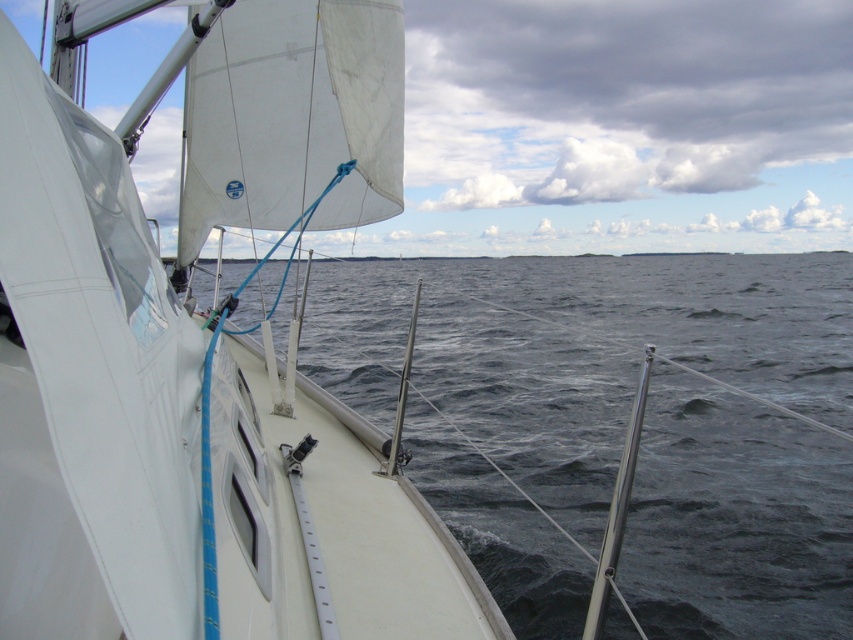
Question: Which point appears closest to the camera in this image?

Choices:
 (A) (224, 547)
 (B) (505, 385)

Answer: (A)

Question: From the image, what is the correct spatial relationship of white matte sailboat at left in relation to dark blue water at center?

Choices:
 (A) above
 (B) below

Answer: (B)

Question: Is the position of white matte sailboat at left more distant than that of dark blue water at center?

Choices:
 (A) no
 (B) yes

Answer: (A)

Question: Does white matte sailboat at left have a smaller size compared to dark blue water at center?

Choices:
 (A) no
 (B) yes

Answer: (B)